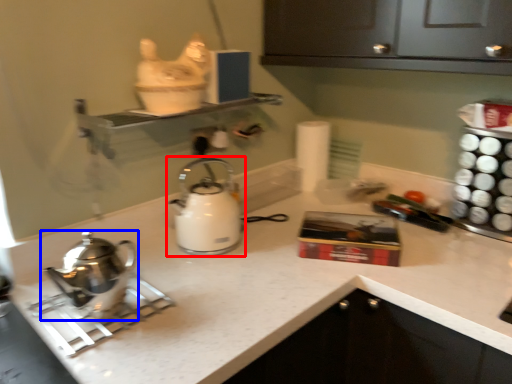
Question: Among these objects, which one is farthest to the camera, kettle (highlighted by a red box) or kettle (highlighted by a blue box)?

Choices:
 (A) kettle
 (B) kettle

Answer: (A)